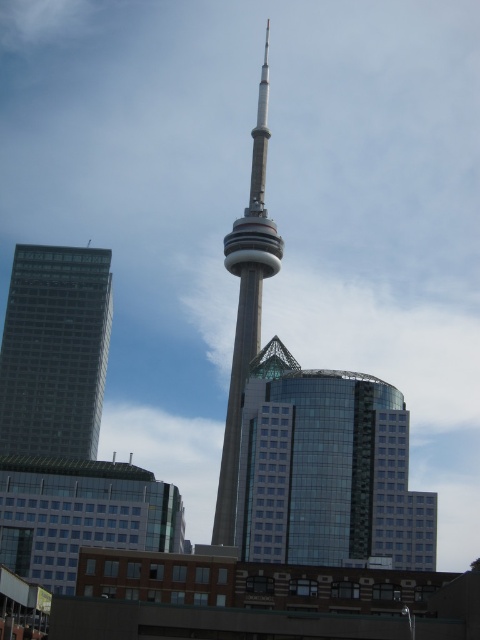
You are standing at the base of the CN Tower and looking towards the left. There is a point marked at coordinates [55,349]. Which object does this point correspond to?

The point at coordinates [55,349] corresponds to the green glass building at left.

You are standing in the city square and see two points in the image. The first point is at coordinates point (63, 282) and the second point is at point (259, 264). Which point is closer to you?

Point (63, 282) is in front of point (259, 264), so the first point is closer to you.

You are standing at the base of the CN Tower and want to reach the green glass building at left. Considering the distance between you and the building is 114.15 meters, can you walk there in under 2 minutes if your walking speed is 1.5 meters per second?

The distance between you and the green glass building at left is 114.15 meters. At a walking speed of 1.5 meters per second, it would take approximately 76 seconds, which is about 1 minute and 16 seconds. Therefore, you can reach the green glass building at left in under 2 minutes.